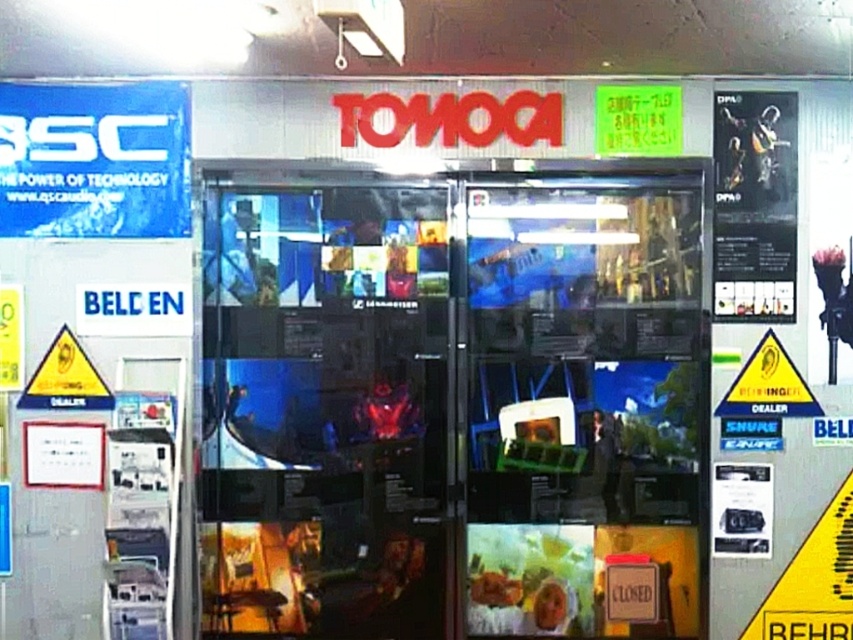
Question: Can you confirm if blue plastic sign at upper left is thinner than green plastic sign at upper center?

Choices:
 (A) no
 (B) yes

Answer: (A)

Question: Is blue plastic sign at upper left wider than green plastic sign at upper center?

Choices:
 (A) yes
 (B) no

Answer: (A)

Question: Among these objects, which one is farthest from the camera?

Choices:
 (A) blue plastic sign at upper left
 (B) green plastic sign at upper center

Answer: (B)

Question: Observing the image, what is the correct spatial positioning of blue plastic sign at upper left in reference to green plastic sign at upper center?

Choices:
 (A) right
 (B) left

Answer: (B)

Question: Which point is farther to the camera?

Choices:
 (A) (666, 129)
 (B) (115, 93)

Answer: (B)

Question: Which object appears closest to the camera in this image?

Choices:
 (A) green plastic sign at upper center
 (B) blue plastic sign at upper left

Answer: (B)